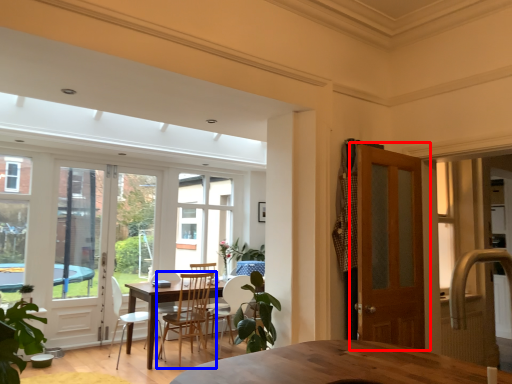
Question: Which of the following is the farthest to the observer, door (highlighted by a red box) or chair (highlighted by a blue box)?

Choices:
 (A) door
 (B) chair

Answer: (B)